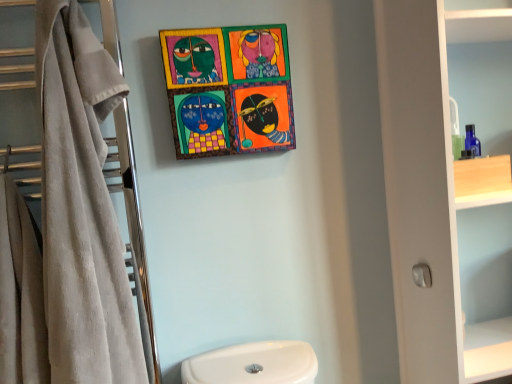
Question: Visually, is white matte cabinet at right positioned to the left or to the right of wooden painted artwork at upper center?

Choices:
 (A) right
 (B) left

Answer: (A)

Question: Is point [x=415, y=64] positioned closer to the camera than point [x=185, y=96]?

Choices:
 (A) closer
 (B) farther

Answer: (A)

Question: Considering the real-world distances, which object is closest to the beige soft towel at left?

Choices:
 (A) wooden painted artwork at upper center
 (B) white matte cabinet at right
 (C) beige towel at left

Answer: (C)

Question: Which object is positioned farthest from the white matte cabinet at right?

Choices:
 (A) beige towel at left
 (B) wooden painted artwork at upper center
 (C) beige soft towel at left

Answer: (C)